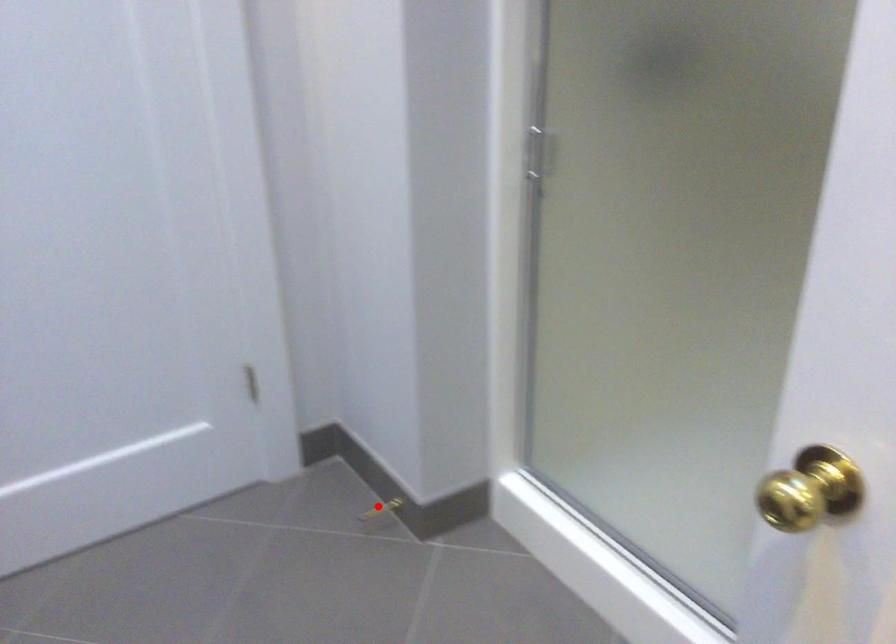
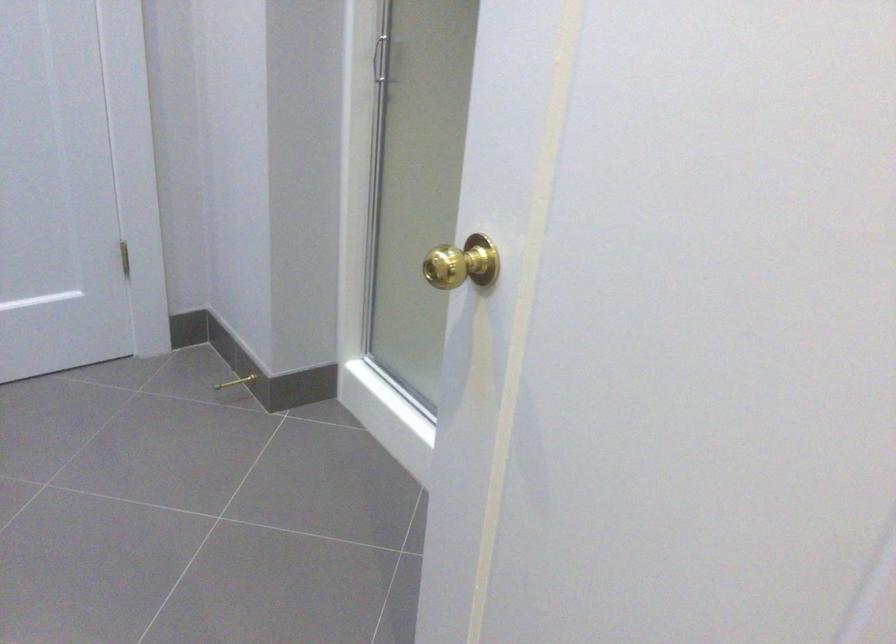
In the second image, find the point that corresponds to the highlighted location in the first image.

(235, 382)